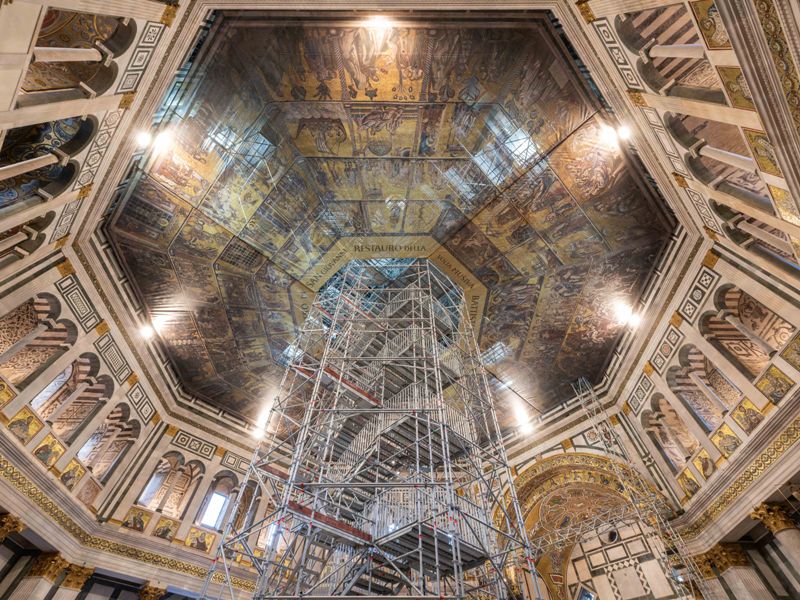
Identify the location of reflection of light on ceiling. (164, 318), (166, 144), (378, 29), (606, 139), (618, 309), (518, 403), (262, 416).